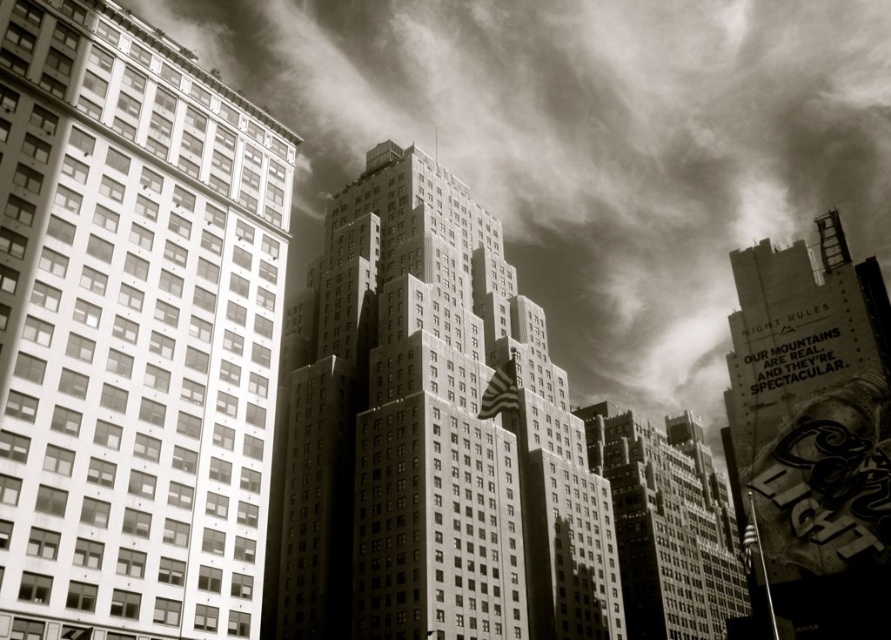
Is point (80, 413) closer to camera compared to point (790, 524)?

That is True.

Is point (246, 547) farther from camera compared to point (827, 396)?

No.

Locate an element on the screen. smooth glass building at left is located at coordinates (133, 330).

Who is shorter, cloudy sky at upper center or smooth concrete skyscraper at center?

smooth concrete skyscraper at center is shorter.

Can you confirm if cloudy sky at upper center is wider than smooth concrete skyscraper at center?

Yes, cloudy sky at upper center is wider than smooth concrete skyscraper at center.

This screenshot has width=891, height=640. I want to click on cloudy sky at upper center, so click(x=587, y=145).

Does metallic billboard at right have a greater width compared to smooth stone skyscraper at center?

No, metallic billboard at right is not wider than smooth stone skyscraper at center.

Is point (861, 307) less distant than point (697, 499)?

Yes, point (861, 307) is in front of point (697, 499).

Is point (840, 426) positioned behind point (685, 499)?

That is False.

Where is `metallic billboard at right`? metallic billboard at right is located at coordinates (815, 432).